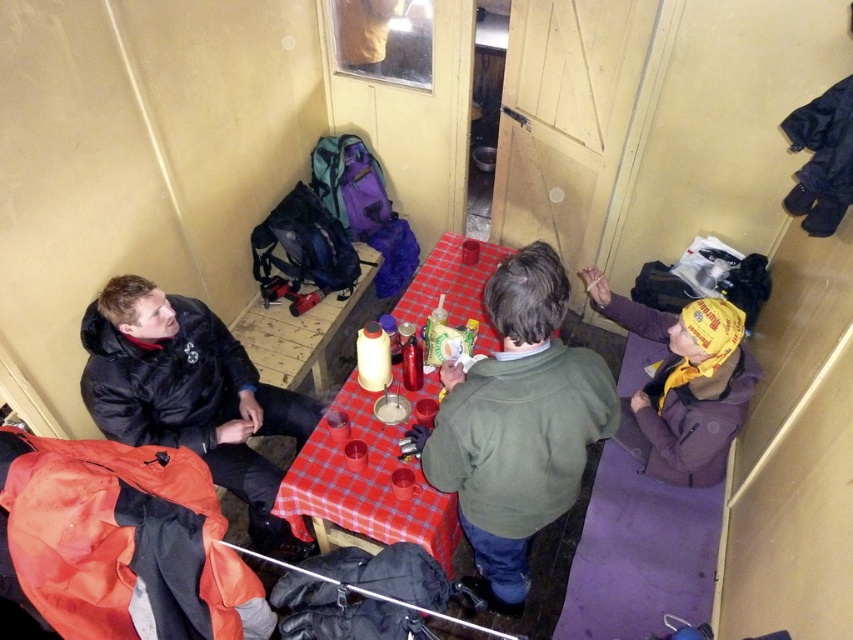
Question: Does black matte jacket at left appear on the right side of red checkered tablecloth at center?

Choices:
 (A) yes
 (B) no

Answer: (B)

Question: Is green matte sweater at center thinner than red checkered tablecloth at center?

Choices:
 (A) yes
 (B) no

Answer: (A)

Question: Which of the following is the closest to the observer?

Choices:
 (A) yellow fabric headband at right
 (B) red checkered tablecloth at center
 (C) green matte sweater at center

Answer: (C)

Question: Can you confirm if black matte jacket at left is positioned above red checkered tablecloth at center?

Choices:
 (A) yes
 (B) no

Answer: (B)

Question: Among these objects, which one is nearest to the camera?

Choices:
 (A) yellow fabric headband at right
 (B) red checkered tablecloth at center
 (C) black matte jacket at left

Answer: (B)

Question: Which is nearer to the yellow fabric headband at right?

Choices:
 (A) green matte sweater at center
 (B) black matte jacket at left

Answer: (A)